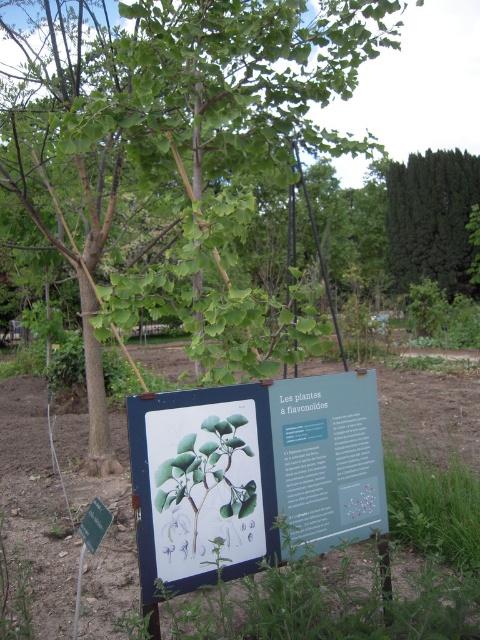
Does green leafy tree at center have a larger size compared to brown soil at center?

Indeed, green leafy tree at center has a larger size compared to brown soil at center.

Is point (15, 38) more distant than point (17, 403)?

That is False.

Find the location of a particular element. green leafy tree at center is located at coordinates (194, 81).

Between green leafy tree at center and green paper sign at center, which one is positioned lower?

Positioned lower is green paper sign at center.

Between point (165, 58) and point (144, 566), which one is positioned behind?

The point (165, 58) is behind.

This screenshot has width=480, height=640. Describe the element at coordinates (194, 81) in the screenshot. I see `green leafy tree at center` at that location.

Image resolution: width=480 pixels, height=640 pixels. In order to click on green leafy tree at center in this screenshot , I will do `click(194, 81)`.

Measure the distance between green paper sign at center and camera.

A distance of 6.98 feet exists between green paper sign at center and camera.

Does point (183, 436) come behind point (122, 432)?

No, (183, 436) is closer to viewer.

Where is `green paper sign at center`? The width and height of the screenshot is (480, 640). green paper sign at center is located at coordinates (252, 474).